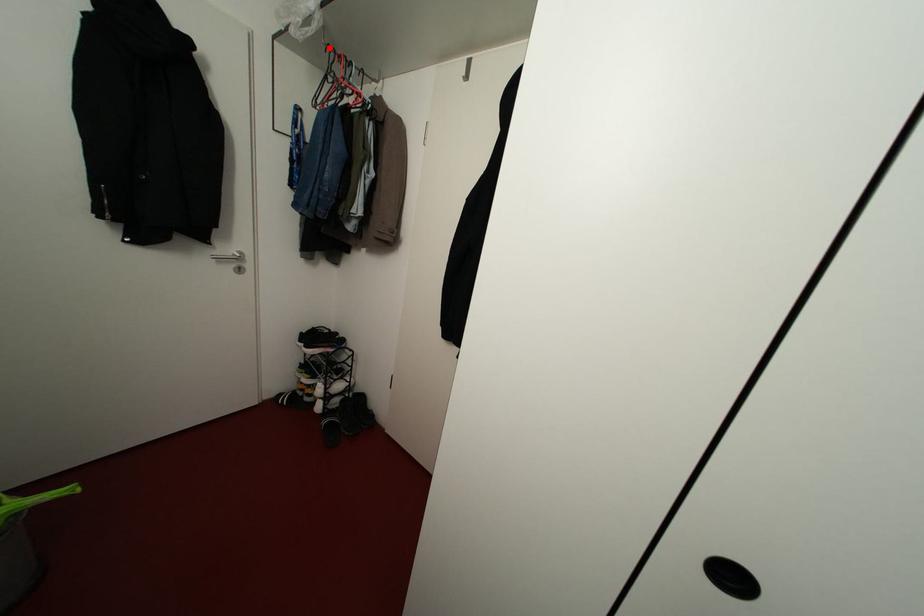
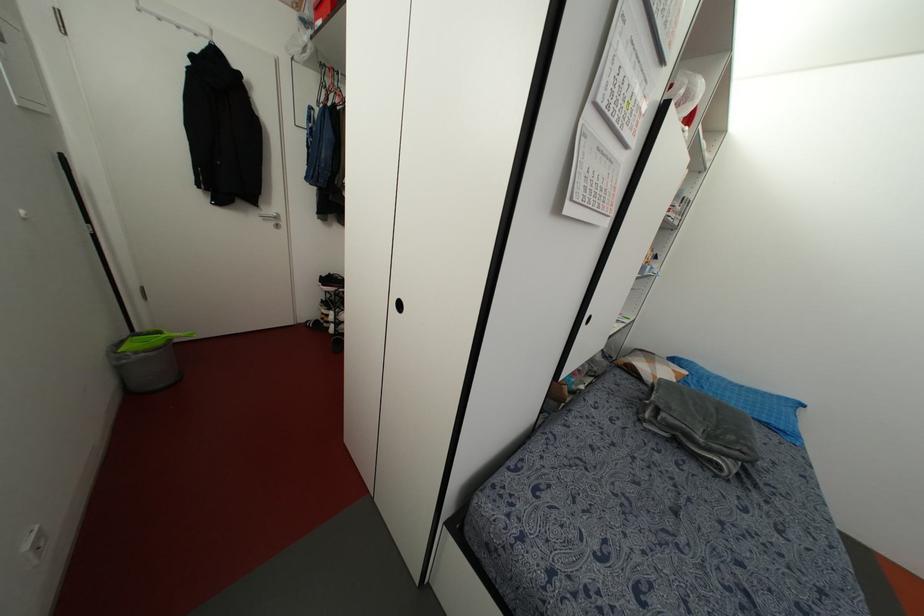
Find the pixel in the second image that matches the highlighted location in the first image.

(322, 63)